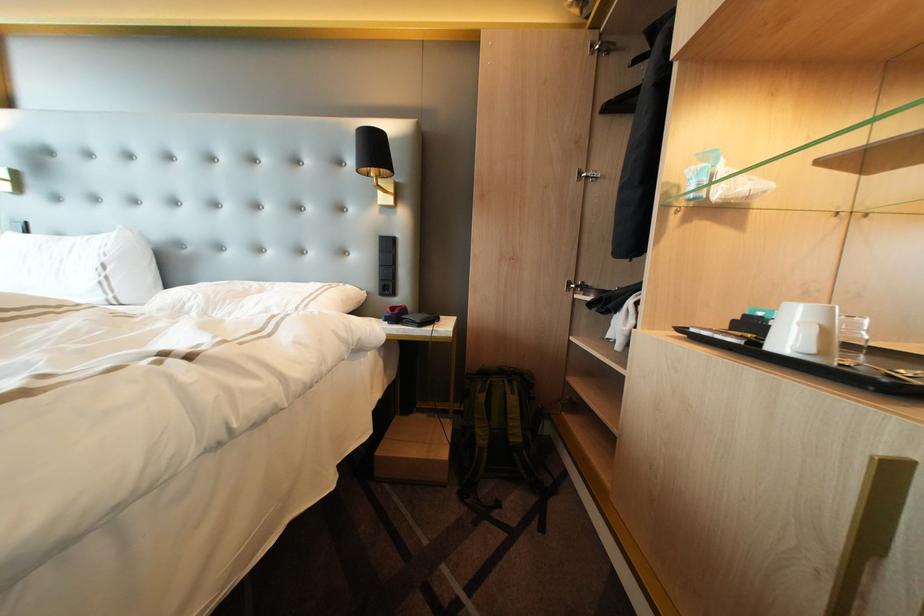
Find where to lift the white cup handle. Please return your answer as a coordinate pair (x, y).

(809, 339)